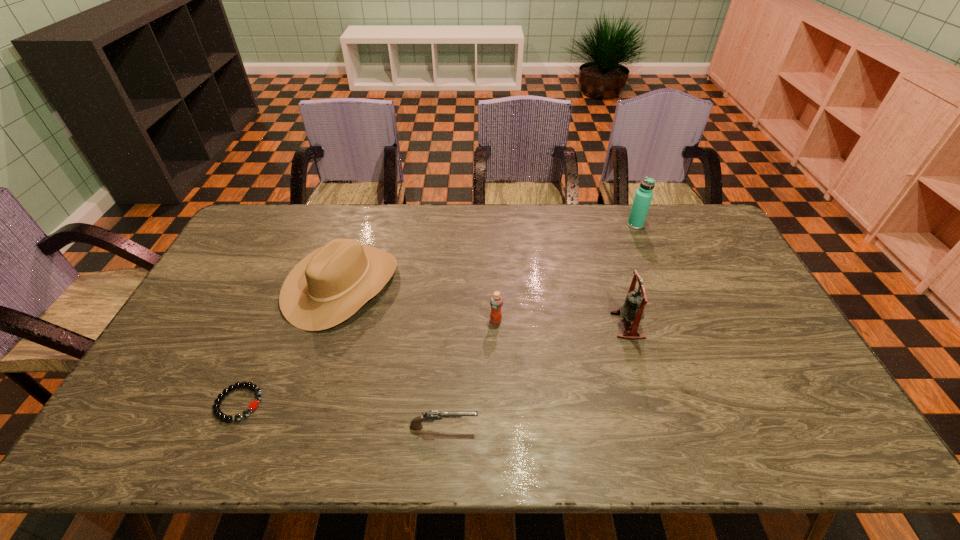
Where is `free space located 0.300m on the left of the fifth object from left to right`? Image resolution: width=960 pixels, height=540 pixels. free space located 0.300m on the left of the fifth object from left to right is located at coordinates (510, 325).

You are a GUI agent. You are given a task and a screenshot of the screen. Output one action in this format:
    pyautogui.click(x=<x>, y=<y>)
    Task: Click on the vacant space located 0.100m on the front of the cowboy hat
    
    Given the screenshot: What is the action you would take?
    pyautogui.click(x=318, y=362)

I want to click on free space located 0.220m on the right of the third shortest object, so click(577, 320).

You are a GUI agent. You are given a task and a screenshot of the screen. Output one action in this format:
    pyautogui.click(x=<x>, y=<y>)
    Task: Click on the free space located 0.230m aiming along the barrel of the fourth object from right to left
    The height and width of the screenshot is (540, 960).
    Given the screenshot: What is the action you would take?
    pyautogui.click(x=575, y=427)

The image size is (960, 540). I want to click on blank area located 0.120m on the right of the bracelet, so click(x=310, y=403).

Identify the location of object that is positioned at the far edge. (643, 196).

The width and height of the screenshot is (960, 540). I want to click on gun at the near edge, so click(x=429, y=416).

Locate an element on the screen. bracelet that is at the near edge is located at coordinates (253, 405).

Identify the location of free region at the far edge of the desktop. (579, 224).

You are a GUI agent. You are given a task and a screenshot of the screen. Output one action in this format:
    pyautogui.click(x=<x>, y=<y>)
    Task: Click on the vacant space at the near edge of the desktop
    
    Given the screenshot: What is the action you would take?
    pyautogui.click(x=249, y=433)